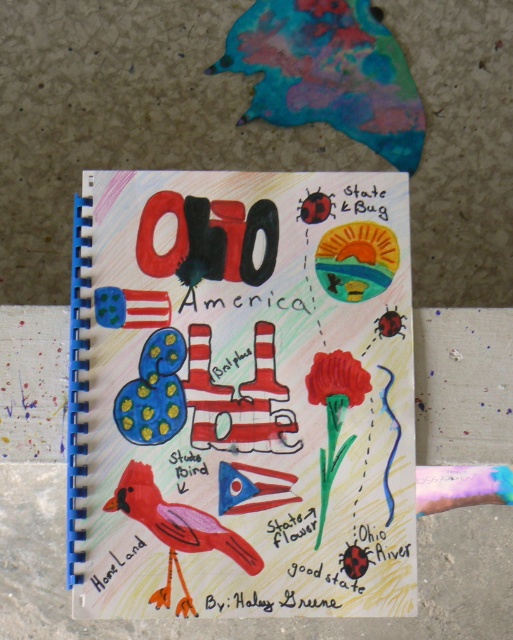
Question: Can you confirm if smooth pink bird at center is thinner than white paper at lower left?

Choices:
 (A) yes
 (B) no

Answer: (B)

Question: Which of the following is the closest to the observer?

Choices:
 (A) matte red flower at center
 (B) colored paper notebook at center
 (C) white paper at lower left

Answer: (B)

Question: Does colored paper notebook at center have a smaller size compared to smooth pink bird at center?

Choices:
 (A) yes
 (B) no

Answer: (B)

Question: Which point is farther to the camera?

Choices:
 (A) matte red flower at center
 (B) white paper at lower left
 (C) colored paper notebook at center
 (D) smooth pink bird at center

Answer: (A)

Question: Can you confirm if matte red flower at center is positioned above white paper at lower left?

Choices:
 (A) yes
 (B) no

Answer: (A)

Question: Among these points, which one is farthest from the camera?

Choices:
 (A) (113, 556)
 (B) (313, 324)
 (C) (123, 477)

Answer: (B)